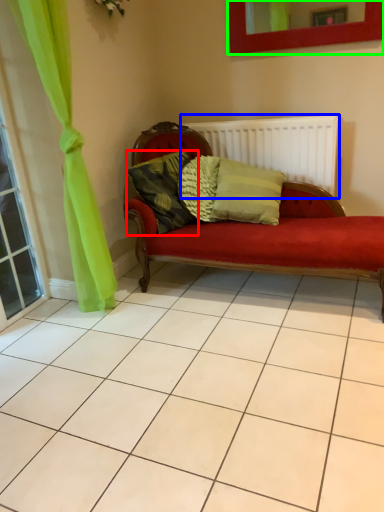
Question: Considering the real-world distances, which object is closest to pillow (highlighted by a red box)? radiator (highlighted by a blue box) or picture frame (highlighted by a green box).

Choices:
 (A) radiator
 (B) picture frame

Answer: (A)